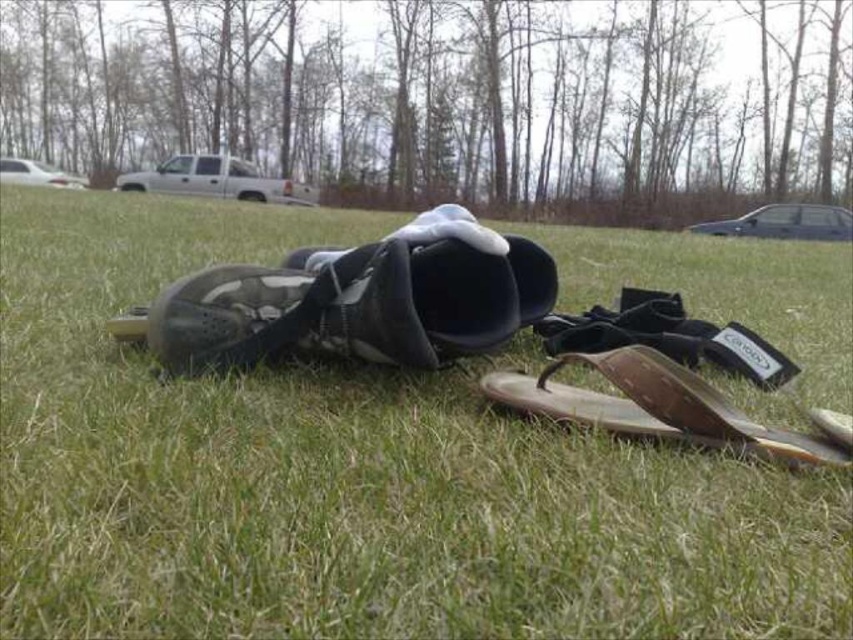
Question: Can you confirm if white matte truck at upper center is wider than white glossy car at upper left?

Choices:
 (A) no
 (B) yes

Answer: (B)

Question: Considering the real-world distances, which object is closest to the brown leather flip-flop at lower right?

Choices:
 (A) matte black roller skate at center
 (B) white matte truck at upper center
 (C) matte black shoe at center
 (D) dark gray metallic car at upper right

Answer: (C)

Question: Among these objects, which one is nearest to the camera?

Choices:
 (A) white glossy car at upper left
 (B) white matte truck at upper center
 (C) matte black roller skate at center
 (D) matte black shoe at center

Answer: (C)

Question: Which point is closer to the camera?

Choices:
 (A) (241, 164)
 (B) (202, 340)
 (C) (614, 385)

Answer: (C)

Question: Observing the image, what is the correct spatial positioning of matte black shoe at center in reference to dark gray metallic car at upper right?

Choices:
 (A) left
 (B) right

Answer: (A)

Question: Can you confirm if matte black roller skate at center is positioned above white matte truck at upper center?

Choices:
 (A) yes
 (B) no

Answer: (B)